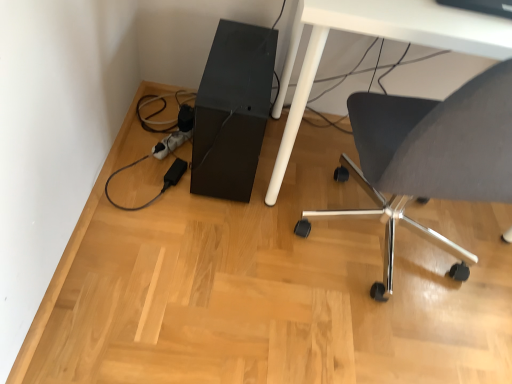
The height and width of the screenshot is (384, 512). What do you see at coordinates (232, 111) in the screenshot?
I see `black matte computer tower at lower center` at bounding box center [232, 111].

Where is `black matte computer tower at lower center`? This screenshot has height=384, width=512. black matte computer tower at lower center is located at coordinates (232, 111).

Measure the distance between point (x=424, y=191) and camera.

Point (x=424, y=191) is 1.05 meters away from camera.

Locate an element on the screen. The width and height of the screenshot is (512, 384). white glossy table at lower right is located at coordinates (380, 37).

In the image, is white glossy table at lower right positioned in front of or behind black matte computer tower at lower center?

white glossy table at lower right is in front of black matte computer tower at lower center.

Is white glossy table at lower right smaller than black matte computer tower at lower center?

Incorrect, white glossy table at lower right is not smaller in size than black matte computer tower at lower center.

Which is closer, (x=377, y=5) or (x=196, y=99)?

Positioned in front is point (x=377, y=5).

In the image, is white glossy table at lower right on the left side or the right side of black matte computer tower at lower center?

Based on their positions, white glossy table at lower right is located to the right of black matte computer tower at lower center.

Who is taller, matte gray chair at lower right or black matte computer tower at lower center?

matte gray chair at lower right is taller.

Can you confirm if matte gray chair at lower right is positioned to the right of black matte computer tower at lower center?

Yes, matte gray chair at lower right is to the right of black matte computer tower at lower center.

Measure the distance between matte gray chair at lower right and black matte computer tower at lower center.

matte gray chair at lower right and black matte computer tower at lower center are 16.50 inches apart from each other.

Is point (475, 177) more distant than point (263, 117)?

That is False.

Which object is more forward, matte gray chair at lower right or white glossy table at lower right?

matte gray chair at lower right is closer to the camera.

This screenshot has width=512, height=384. What are the coordinates of `chair located on the left of white glossy table at lower right` in the screenshot? It's located at pos(431,156).

From the image's perspective, is matte gray chair at lower right below white glossy table at lower right?

Yes.

From the image's perspective, would you say black matte computer tower at lower center is positioned over white glossy table at lower right?

No.

Would you say black matte computer tower at lower center is a long distance from white glossy table at lower right?

No, there isn't a large distance between black matte computer tower at lower center and white glossy table at lower right.

Does black matte computer tower at lower center appear on the right side of white glossy table at lower right?

No, black matte computer tower at lower center is not to the right of white glossy table at lower right.

What's the angular difference between white glossy table at lower right and matte gray chair at lower right's facing directions?

white glossy table at lower right and matte gray chair at lower right are facing 179 degrees away from each other.

Consider the image. In the image, is white glossy table at lower right positioned in front of or behind matte gray chair at lower right?

Clearly, white glossy table at lower right is behind matte gray chair at lower right.

Is white glossy table at lower right positioned far away from matte gray chair at lower right?

white glossy table at lower right is actually quite close to matte gray chair at lower right.

Looking at this image, is white glossy table at lower right inside or outside of matte gray chair at lower right?

white glossy table at lower right cannot be found inside matte gray chair at lower right.

Is black matte computer tower at lower center not near matte gray chair at lower right?

No.

In the scene shown: Considering the sizes of objects black matte computer tower at lower center and matte gray chair at lower right in the image provided, who is bigger, black matte computer tower at lower center or matte gray chair at lower right?

Bigger between the two is matte gray chair at lower right.

Based on the photo, would you say matte gray chair at lower right is part of black matte computer tower at lower center's contents?

Definitely not — matte gray chair at lower right is not inside black matte computer tower at lower center.

I want to click on computer tower below the white glossy table at lower right (from the image's perspective), so click(x=232, y=111).

This screenshot has height=384, width=512. In order to click on chair located above the black matte computer tower at lower center (from a real-world perspective) in this screenshot , I will do `click(431, 156)`.

When comparing their distances from black matte computer tower at lower center, does matte gray chair at lower right or white glossy table at lower right seem closer?

The object closer to black matte computer tower at lower center is white glossy table at lower right.

Which object lies further to the anchor point matte gray chair at lower right, white glossy table at lower right or black matte computer tower at lower center?

black matte computer tower at lower center is positioned further to the anchor matte gray chair at lower right.

Which object lies nearer to the anchor point black matte computer tower at lower center, white glossy table at lower right or matte gray chair at lower right?

white glossy table at lower right is closer to black matte computer tower at lower center.

Estimate the real-world distances between objects in this image. Which object is closer to white glossy table at lower right, matte gray chair at lower right or black matte computer tower at lower center?

black matte computer tower at lower center.

Based on their spatial positions, is black matte computer tower at lower center or white glossy table at lower right closer to matte gray chair at lower right?

Among the two, white glossy table at lower right is located nearer to matte gray chair at lower right.

When comparing their distances from white glossy table at lower right, does black matte computer tower at lower center or matte gray chair at lower right seem further?

matte gray chair at lower right is further to white glossy table at lower right.

At what (x,y) coordinates should I click in order to perform the action: click on chair between black matte computer tower at lower center and white glossy table at lower right in the horizontal direction. Please return your answer as a coordinate pair (x, y). The image size is (512, 384). Looking at the image, I should click on (431, 156).